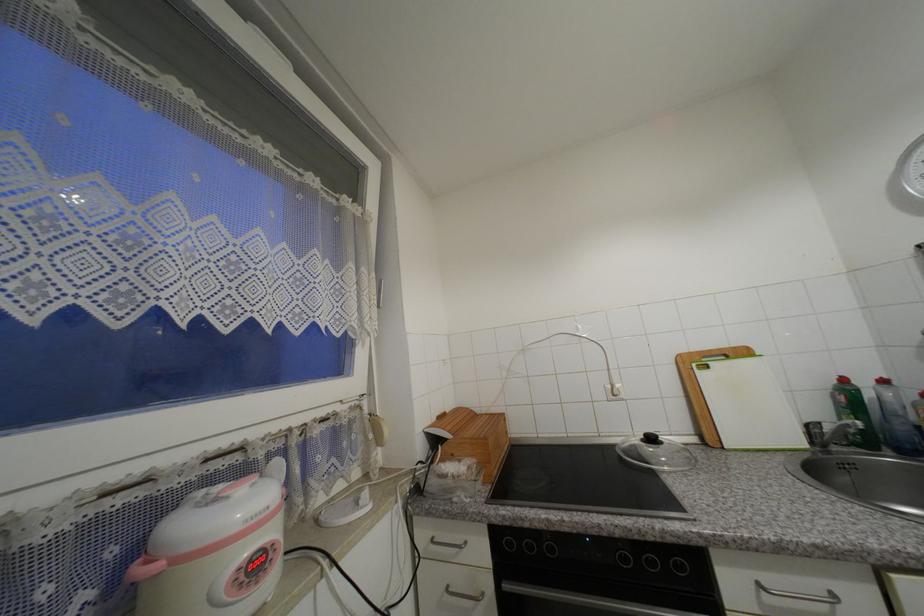
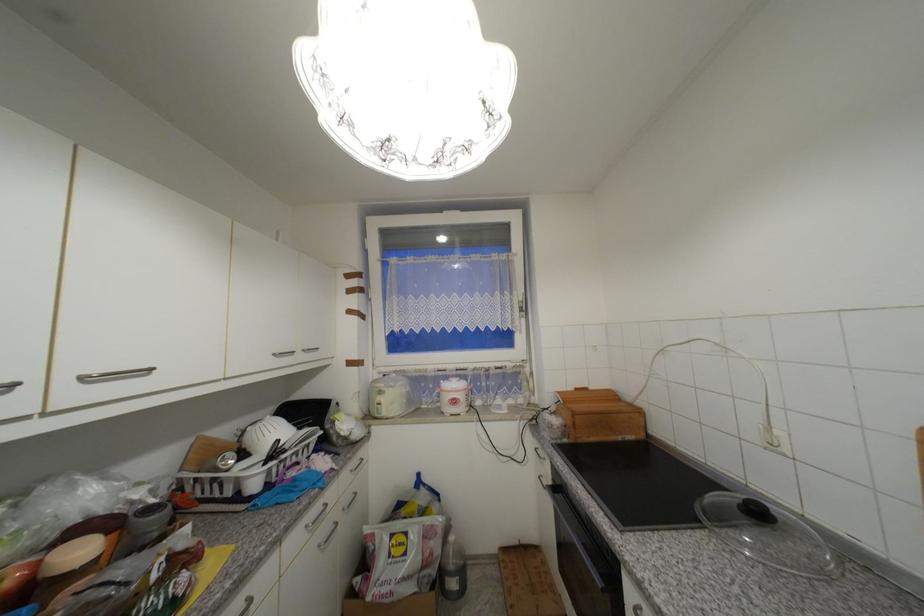
In the second image, find the point that corresponds to point (440, 419) in the first image.

(576, 390)